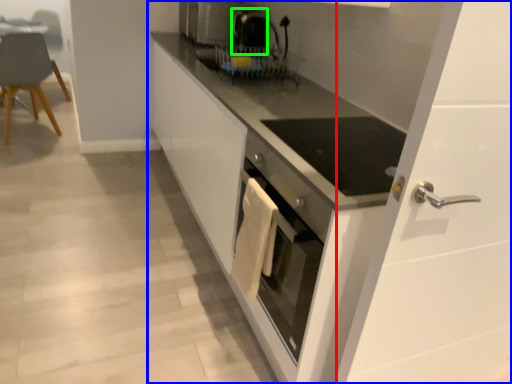
Question: Considering the real-world distances, which object is closest to glass door (highlighted by a red box)? cabinetry (highlighted by a blue box) or coffee machine (highlighted by a green box).

Choices:
 (A) cabinetry
 (B) coffee machine

Answer: (A)